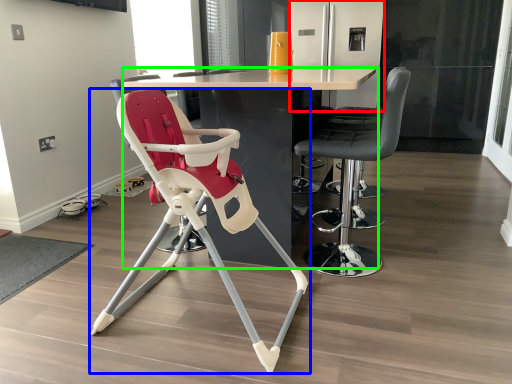
Question: Considering the real-world distances, which object is closest to screen door (highlighted by a red box)? chair (highlighted by a blue box) or table (highlighted by a green box).

Choices:
 (A) chair
 (B) table

Answer: (B)